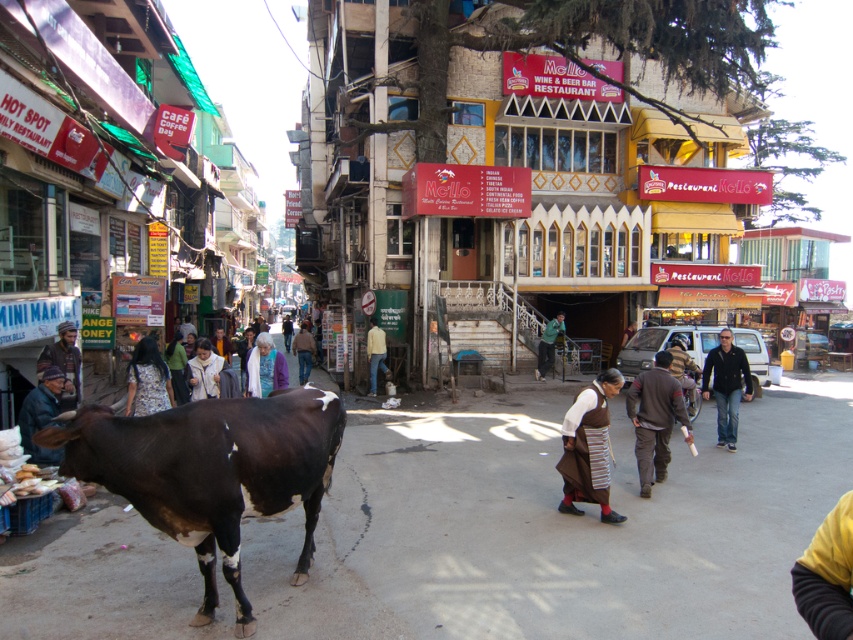
Is point (326, 458) behind point (804, 609)?

Yes, point (326, 458) is behind point (804, 609).

The width and height of the screenshot is (853, 640). What are the coordinates of `black glossy bull at lower left` in the screenshot? It's located at (212, 472).

Is black glossy bull at lower left to the left of dark brown leather jacket at lower left from the viewer's perspective?

Incorrect, black glossy bull at lower left is not on the left side of dark brown leather jacket at lower left.

Is black glossy bull at lower left shorter than dark brown leather jacket at lower left?

No.

Is point (184, 493) closer to camera compared to point (62, 387)?

Yes.

Image resolution: width=853 pixels, height=640 pixels. Find the location of `black glossy bull at lower left`. black glossy bull at lower left is located at coordinates (212, 472).

Can you confirm if black glossy bull at lower left is positioned below white cotton shirt at center?

Indeed, black glossy bull at lower left is positioned under white cotton shirt at center.

Which is in front, point (312, 456) or point (201, 362)?

Positioned in front is point (312, 456).

Between point (300, 548) and point (202, 344), which one is positioned in front?

Positioned in front is point (300, 548).

Where is `black glossy bull at lower left`? black glossy bull at lower left is located at coordinates (212, 472).